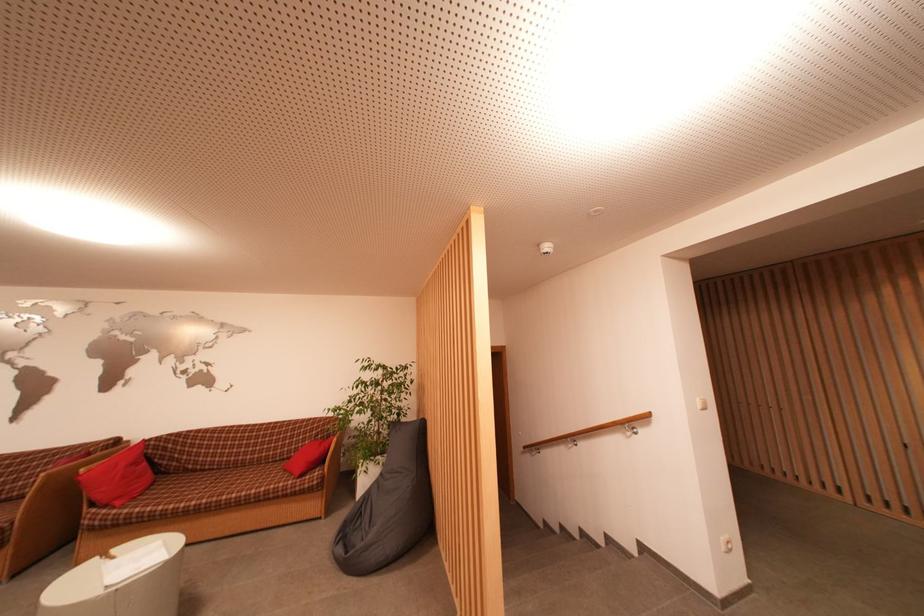
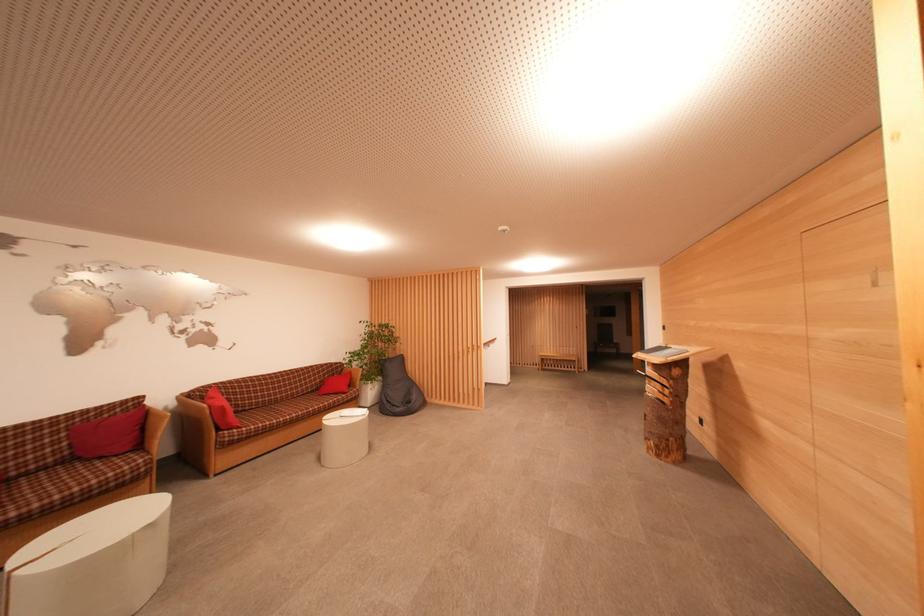
Locate, in the second image, the point that corresponds to point 333,439 in the first image.

(337, 378)